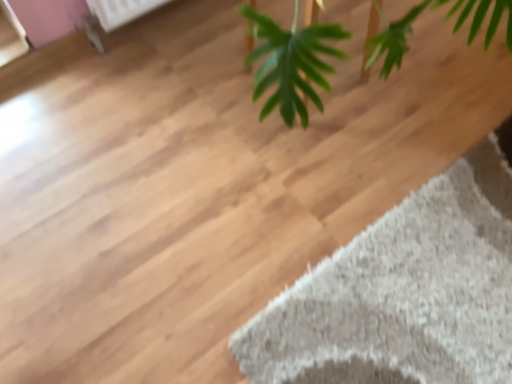
Where is `vacant area on top of white shaggy rug at lower right (from a real-world perspective)`? Image resolution: width=512 pixels, height=384 pixels. vacant area on top of white shaggy rug at lower right (from a real-world perspective) is located at coordinates (423, 281).